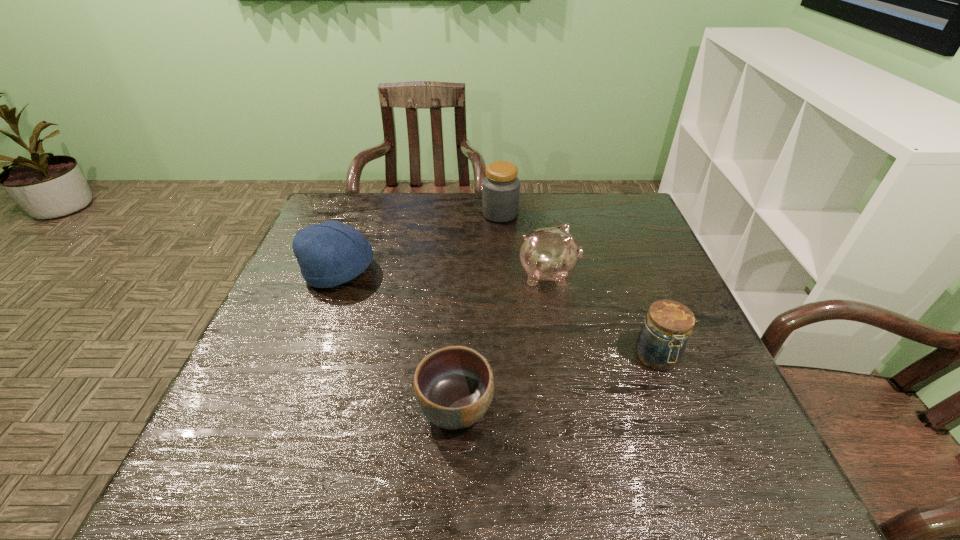
Locate an element on the screen. This screenshot has height=540, width=960. the taller jar is located at coordinates (500, 188).

Find the location of a particular element. This screenshot has height=540, width=960. the farther jar is located at coordinates (500, 188).

At what (x,y) coordinates should I click in order to perform the action: click on skullcap. Please return your answer as a coordinate pair (x, y). Looking at the image, I should click on (329, 254).

Where is `piggy bank`? piggy bank is located at coordinates (546, 254).

What are the coordinates of `the nearer jar` in the screenshot? It's located at (662, 340).

In order to click on the shorter jar in this screenshot , I will do `click(662, 340)`.

This screenshot has height=540, width=960. I want to click on bowl, so click(453, 386).

This screenshot has height=540, width=960. What are the coordinates of `free space located on the surface of the taller jar near the warning symbol` in the screenshot? It's located at (358, 214).

Identify the location of vacant space located 0.110m on the surface of the taller jar near the warning symbol. (448, 214).

Identify the location of blank space located 0.050m on the surface of the taller jar near the warning symbol. The width and height of the screenshot is (960, 540). (467, 214).